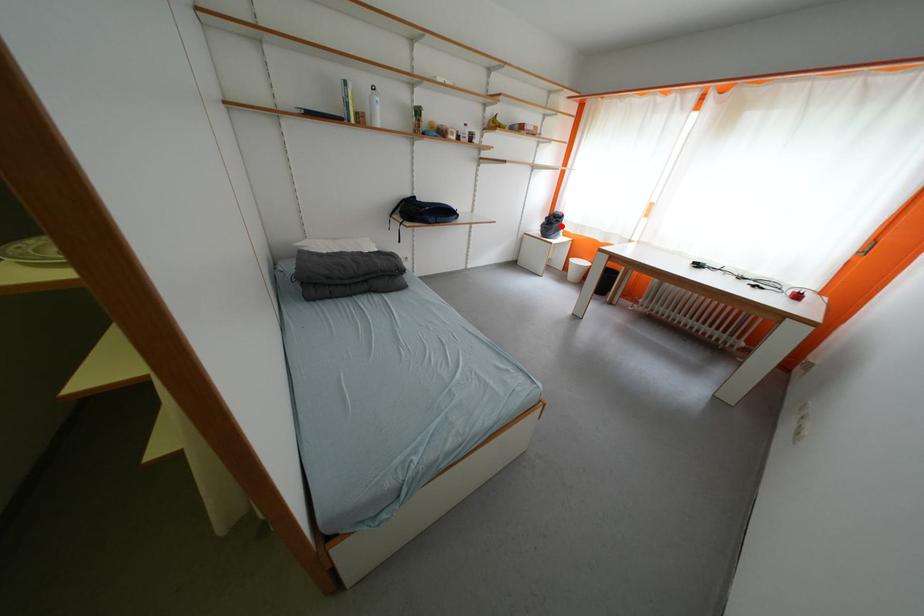
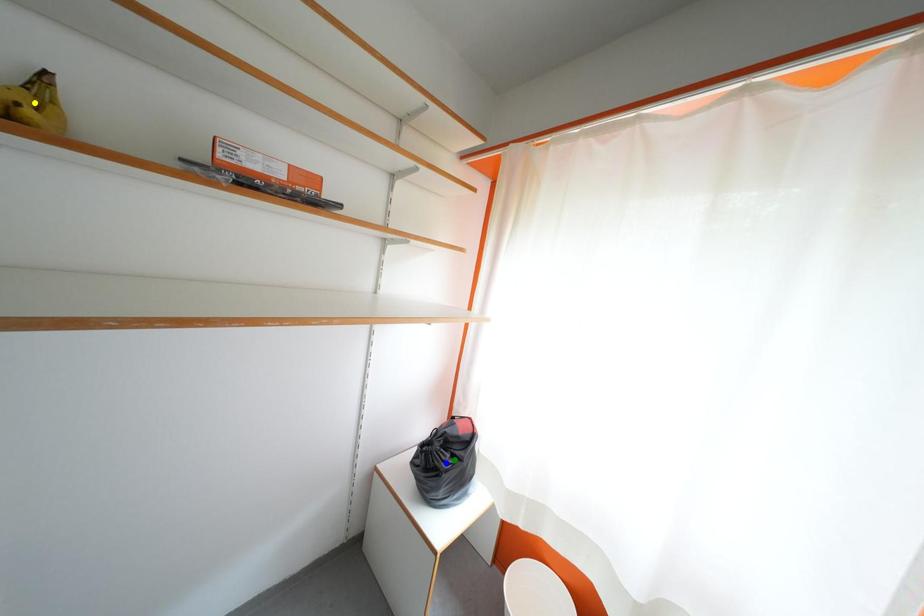
Question: I am providing you with two images of the same scene from different viewpoints. A red point is marked on the first image. You are given multiple points on the second image. Can you choose the point in image 2 that corresponds to the point in image 1?

Choices:
 (A) blue point
 (B) yellow point
 (C) green point

Answer: (C)